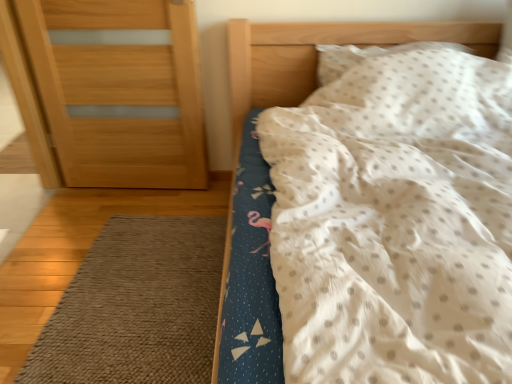
Question: Is brown textured rug at lower left shorter than white dotted fabric at upper right?

Choices:
 (A) yes
 (B) no

Answer: (A)

Question: Considering the relative sizes of brown textured rug at lower left and white dotted fabric at upper right in the image provided, is brown textured rug at lower left bigger than white dotted fabric at upper right?

Choices:
 (A) no
 (B) yes

Answer: (A)

Question: Considering the relative sizes of brown textured rug at lower left and white dotted fabric at upper right in the image provided, is brown textured rug at lower left wider than white dotted fabric at upper right?

Choices:
 (A) yes
 (B) no

Answer: (B)

Question: From the image's perspective, is brown textured rug at lower left over white dotted fabric at upper right?

Choices:
 (A) yes
 (B) no

Answer: (B)

Question: Is brown textured rug at lower left positioned before white dotted fabric at upper right?

Choices:
 (A) no
 (B) yes

Answer: (A)

Question: From a real-world perspective, relative to brown textured rug at lower left, is wooden door at left vertically above or below?

Choices:
 (A) below
 (B) above

Answer: (B)

Question: Choose the correct answer: Is wooden door at left inside brown textured rug at lower left or outside it?

Choices:
 (A) inside
 (B) outside

Answer: (B)

Question: Is wooden door at left taller or shorter than brown textured rug at lower left?

Choices:
 (A) short
 (B) tall

Answer: (B)

Question: In the image, is wooden door at left positioned in front of or behind brown textured rug at lower left?

Choices:
 (A) front
 (B) behind

Answer: (B)

Question: Relative to white dotted fabric at upper right, is wooden door at left in front or behind?

Choices:
 (A) front
 (B) behind

Answer: (B)

Question: Considering the positions of wooden door at left and white dotted fabric at upper right in the image, is wooden door at left taller or shorter than white dotted fabric at upper right?

Choices:
 (A) tall
 (B) short

Answer: (B)

Question: Considering the positions of wooden door at left and white dotted fabric at upper right in the image, is wooden door at left wider or thinner than white dotted fabric at upper right?

Choices:
 (A) wide
 (B) thin

Answer: (B)

Question: From the image's perspective, is wooden door at left above or below white dotted fabric at upper right?

Choices:
 (A) above
 (B) below

Answer: (A)

Question: Is white dotted pillow at upper right bigger or smaller than wooden door at left?

Choices:
 (A) big
 (B) small

Answer: (B)

Question: From a real-world perspective, is white dotted pillow at upper right positioned above or below wooden door at left?

Choices:
 (A) above
 (B) below

Answer: (A)